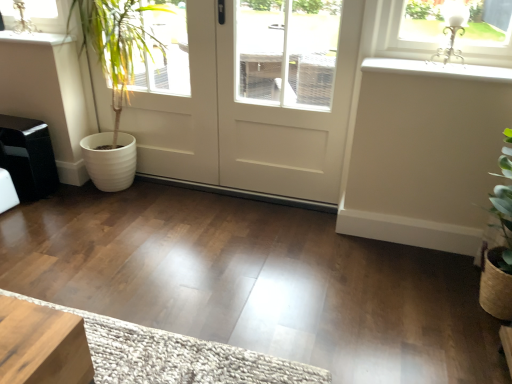
What is the approximate height of white smooth window sill at upper right, arranged as the first window sill when viewed from the front?

It is 1.53 inches.

What do you see at coordinates (117, 43) in the screenshot? I see `white ribbed pot at left` at bounding box center [117, 43].

This screenshot has height=384, width=512. I want to click on white smooth window sill at upper right, the 2th window sill positioned from the left, so click(438, 69).

Would you say white ribbed pot at left is inside or outside white matte door at center?

white ribbed pot at left is contained in white matte door at center.

Is white ribbed pot at left wider or thinner than white matte door at center?

In the image, white ribbed pot at left appears to be wider than white matte door at center.

From the image's perspective, is white ribbed pot at left under white matte door at center?

No, from the image's perspective, white ribbed pot at left is not beneath white matte door at center.

From a real-world perspective, is white ribbed pot at left positioned over white matte door at center based on gravity?

No, from a real-world perspective, white ribbed pot at left is not over white matte door at center

From a real-world perspective, is white smooth window sill at upper right, the second window sill positioned from the back, physically below white textured doormat at lower center?

No, from a real-world perspective, white smooth window sill at upper right, the second window sill positioned from the back, is not under white textured doormat at lower center.

What are the coordinates of `window sill on the right of white textured doormat at lower center` in the screenshot? It's located at (438, 69).

In the scene shown: Considering the positions of objects white smooth window sill at upper right, arranged as the first window sill when viewed from the front, and white textured doormat at lower center in the image provided, who is in front, white smooth window sill at upper right, arranged as the first window sill when viewed from the front, or white textured doormat at lower center?

white textured doormat at lower center is closer to the camera.

Measure the distance between white smooth window sill at upper right, the 2th window sill positioned from the left, and white textured doormat at lower center.

white smooth window sill at upper right, the 2th window sill positioned from the left, is 4.04 feet from white textured doormat at lower center.

Could you measure the distance between white smooth window sill at upper right, which is the first window sill from bottom to top, and white ribbed pot at left?

They are 1.23 meters apart.

Is white smooth window sill at upper right, the 2th window sill positioned from the left, spatially inside white ribbed pot at left, or outside of it?

white smooth window sill at upper right, the 2th window sill positioned from the left, is located beyond the bounds of white ribbed pot at left.

From the image's perspective, is white smooth window sill at upper right, which appears as the 2th window sill when viewed from the top, above or below white ribbed pot at left?

white smooth window sill at upper right, which appears as the 2th window sill when viewed from the top, is situated lower than white ribbed pot at left in the image.

Between white smooth window sill at upper right, which is the first window sill from bottom to top, and white ribbed pot at left, which one has larger width?

white smooth window sill at upper right, which is the first window sill from bottom to top.

From a real-world perspective, is white ribbed pot at left on top of white glossy window sill at upper left, the 2th window sill in the front-to-back sequence?

Incorrect, from a real-world perspective, white ribbed pot at left is lower than white glossy window sill at upper left, the 2th window sill in the front-to-back sequence.

Who is more distant, white ribbed pot at left or white glossy window sill at upper left, which is the 2th window sill from right to left?

Positioned behind is white glossy window sill at upper left, which is the 2th window sill from right to left.

Looking at this image, how different are the orientations of white ribbed pot at left and white glossy window sill at upper left, the first window sill in the left-to-right sequence, in degrees?

0.909 degrees.

From the image's perspective, is white ribbed pot at left on top of white glossy window sill at upper left, the 1th window sill positioned from the back?

No, from the image's perspective, white ribbed pot at left is not over white glossy window sill at upper left, the 1th window sill positioned from the back.

From a real-world perspective, is white ribbed pot at left located higher than white smooth window sill at upper right, which is the first window sill from right to left?

Incorrect, from a real-world perspective, white ribbed pot at left is lower than white smooth window sill at upper right, which is the first window sill from right to left.

In the scene shown: Would you consider white ribbed pot at left to be distant from white smooth window sill at upper right, the second window sill positioned from the back?

white ribbed pot at left is positioned a significant distance from white smooth window sill at upper right, the second window sill positioned from the back.

From the image's perspective, is white ribbed pot at left over white smooth window sill at upper right, arranged as the first window sill when viewed from the front?

Indeed, from the image's perspective, white ribbed pot at left is shown above white smooth window sill at upper right, arranged as the first window sill when viewed from the front.

From a real-world perspective, is white glossy window sill at upper left, which ranks as the second window sill in bottom-to-top order, beneath white smooth window sill at upper right, which is the first window sill from bottom to top?

No.

Can you confirm if white glossy window sill at upper left, the first window sill positioned from the top, is bigger than white smooth window sill at upper right, arranged as the first window sill when viewed from the front?

Indeed, white glossy window sill at upper left, the first window sill positioned from the top, has a larger size compared to white smooth window sill at upper right, arranged as the first window sill when viewed from the front.

Is white glossy window sill at upper left, the first window sill in the left-to-right sequence, in front of or behind white smooth window sill at upper right, which appears as the 2th window sill when viewed from the top, in the image?

white glossy window sill at upper left, the first window sill in the left-to-right sequence, is positioned farther from the viewer than white smooth window sill at upper right, which appears as the 2th window sill when viewed from the top.

From the image's perspective, which one is positioned lower, white glossy window sill at upper left, which ranks as the second window sill in bottom-to-top order, or white smooth window sill at upper right, which is the first window sill from bottom to top?

From the image's view, white smooth window sill at upper right, which is the first window sill from bottom to top, is below.

Which object is positioned more to the left, white ribbed pot at left or white textured doormat at lower center?

white ribbed pot at left.

From a real-world perspective, is white ribbed pot at left above or below white textured doormat at lower center?

In terms of real-world spatial position, white ribbed pot at left is above white textured doormat at lower center.

Is white ribbed pot at left shorter than white textured doormat at lower center?

No, white ribbed pot at left is not shorter than white textured doormat at lower center.

The height and width of the screenshot is (384, 512). What are the coordinates of `doormat directly beneath the white ribbed pot at left (from a real-world perspective)` in the screenshot? It's located at (176, 356).

You are a GUI agent. You are given a task and a screenshot of the screen. Output one action in this format:
    pyautogui.click(x=<x>, y=<y>)
    Task: Click on the houseplant below the white matte door at center (from a real-world perspective)
    This screenshot has width=512, height=384.
    Given the screenshot: What is the action you would take?
    pyautogui.click(x=117, y=43)

Locate an element on the screen. the 1st window sill located above the white textured doormat at lower center (from a real-world perspective) is located at coordinates (438, 69).

Based on their spatial positions, is white smooth window sill at upper right, the second window sill positioned from the back, or white glossy window sill at upper left, which is the 2th window sill from right to left, closer to white ribbed pot at left?

white glossy window sill at upper left, which is the 2th window sill from right to left, lies closer to white ribbed pot at left than the other object.

Estimate the real-world distances between objects in this image. Which object is further from white glossy window sill at upper left, the first window sill positioned from the top, white matte door at center or white smooth window sill at upper right, arranged as the first window sill when viewed from the front?

white smooth window sill at upper right, arranged as the first window sill when viewed from the front.

Estimate the real-world distances between objects in this image. Which object is further from white glossy window sill at upper left, which ranks as the second window sill in bottom-to-top order, white textured doormat at lower center or white matte door at center?

The object further to white glossy window sill at upper left, which ranks as the second window sill in bottom-to-top order, is white textured doormat at lower center.

When comparing their distances from white textured doormat at lower center, does white matte door at center or white smooth window sill at upper right, which appears as the 2th window sill when viewed from the top, seem further?

white smooth window sill at upper right, which appears as the 2th window sill when viewed from the top, is positioned further to the anchor white textured doormat at lower center.

Looking at the image, which one is located closer to white matte door at center, white ribbed pot at left or white textured doormat at lower center?

Among the two, white ribbed pot at left is located nearer to white matte door at center.

Looking at the image, which one is located further to white matte door at center, white ribbed pot at left or white glossy window sill at upper left, which is the 2th window sill from right to left?

Among the two, white glossy window sill at upper left, which is the 2th window sill from right to left, is located further to white matte door at center.

From the image, which object appears to be nearer to white smooth window sill at upper right, the second window sill positioned from the back, white matte door at center or white textured doormat at lower center?

white matte door at center is positioned closer to the anchor white smooth window sill at upper right, the second window sill positioned from the back.

Which object lies further to the anchor point white ribbed pot at left, white smooth window sill at upper right, which is the first window sill from bottom to top, or white matte door at center?

The object further to white ribbed pot at left is white smooth window sill at upper right, which is the first window sill from bottom to top.

Locate an element on the screen. The width and height of the screenshot is (512, 384). door between white textured doormat at lower center and white smooth window sill at upper right, which appears as the 2th window sill when viewed from the top, from left to right is located at coordinates (256, 100).

This screenshot has height=384, width=512. What are the coordinates of `door between white ribbed pot at left and white textured doormat at lower center from top to bottom` in the screenshot? It's located at (256, 100).

In order to click on houseplant between white glossy window sill at upper left, the 2th window sill in the front-to-back sequence, and white textured doormat at lower center, in the vertical direction in this screenshot , I will do `click(117, 43)`.

At what (x,y) coordinates should I click in order to perform the action: click on doormat between white ribbed pot at left and white smooth window sill at upper right, which is the first window sill from bottom to top, from left to right. Please return your answer as a coordinate pair (x, y). This screenshot has width=512, height=384. Looking at the image, I should click on (176, 356).